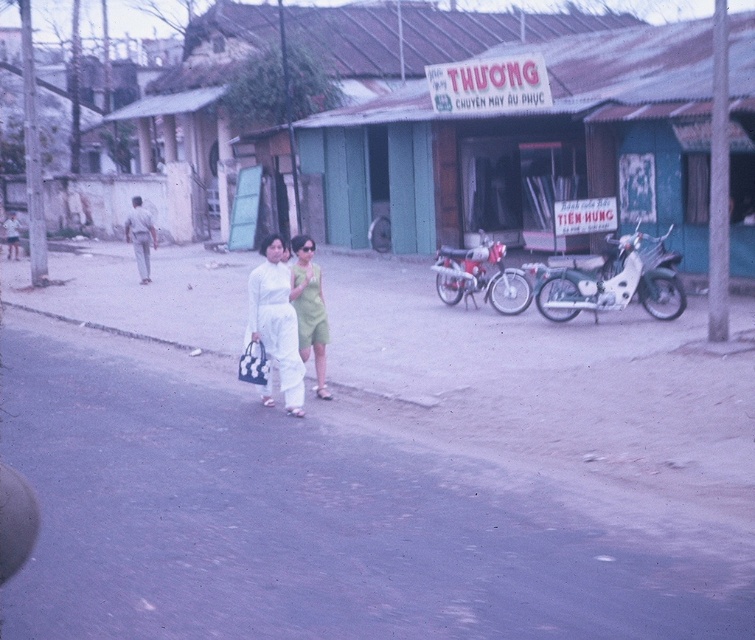
Does metallic red motorcycle at center appear over green matte dress at center?

Yes, metallic red motorcycle at center is above green matte dress at center.

From the picture: Can you confirm if metallic red motorcycle at center is thinner than green matte dress at center?

In fact, metallic red motorcycle at center might be wider than green matte dress at center.

Is point (488, 292) positioned behind point (310, 307)?

That is True.

The width and height of the screenshot is (755, 640). I want to click on metallic red motorcycle at center, so click(x=479, y=276).

Can you confirm if metallic red motorcycle at center is thinner than light gray cotton pants at left?

Yes, metallic red motorcycle at center is thinner than light gray cotton pants at left.

The height and width of the screenshot is (640, 755). I want to click on metallic red motorcycle at center, so click(479, 276).

Measure the distance between point (455, 257) and camera.

A distance of 17.33 meters exists between point (455, 257) and camera.

This screenshot has width=755, height=640. Find the location of `metallic red motorcycle at center`. metallic red motorcycle at center is located at coordinates (479, 276).

Does white matte motorcycle at right appear on the right side of white matte dress at center?

Yes, white matte motorcycle at right is to the right of white matte dress at center.

Who is positioned more to the left, white matte motorcycle at right or white matte dress at center?

white matte dress at center

Between point (629, 275) and point (287, 316), which one is positioned in front?

Point (287, 316) is in front.

Locate an element on the screen. The image size is (755, 640). white matte motorcycle at right is located at coordinates (615, 282).